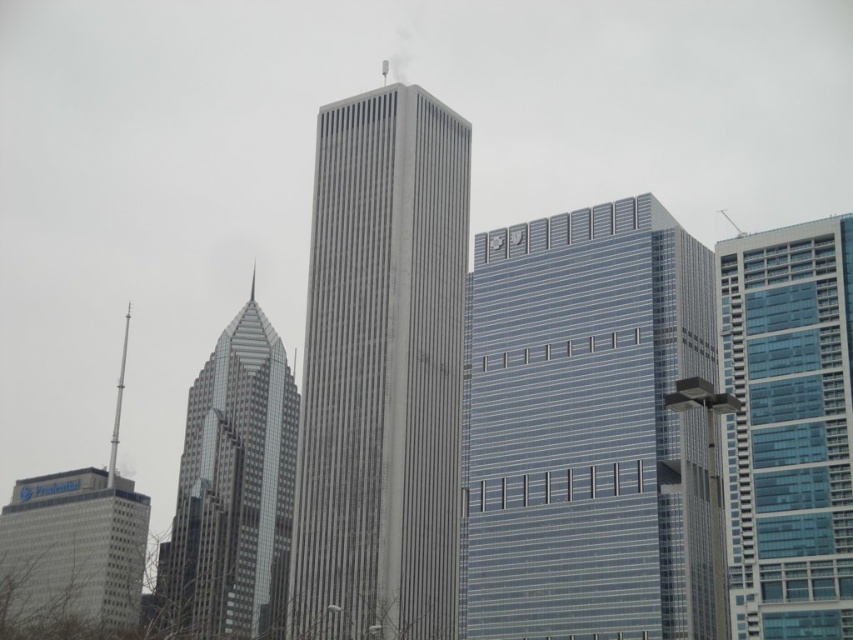
Consider the image. Can you confirm if gray concrete skyscraper at center is positioned to the right of blue glass building at right?

No, gray concrete skyscraper at center is not to the right of blue glass building at right.

Consider the image. Does gray concrete skyscraper at center have a larger size compared to blue glass building at right?

Yes, gray concrete skyscraper at center is bigger than blue glass building at right.

Which is in front, point (350, 602) or point (741, 378)?

Point (741, 378)

Where is `gray concrete skyscraper at center`? This screenshot has height=640, width=853. gray concrete skyscraper at center is located at coordinates (381, 372).

Does glassy silver skyscraper at left have a greater height compared to gray concrete building at lower left?

Indeed, glassy silver skyscraper at left has a greater height compared to gray concrete building at lower left.

Between point (286, 522) and point (22, 556), which one is positioned in front?

Positioned in front is point (286, 522).

Find the location of a particular element. glassy silver skyscraper at left is located at coordinates (234, 488).

Which is in front, point (631, 416) or point (352, 588)?

Point (631, 416) is in front.

Identify the location of glassy blue skyscraper at center. (585, 429).

What are the coordinates of `glassy blue skyscraper at center` in the screenshot? It's located at point(585,429).